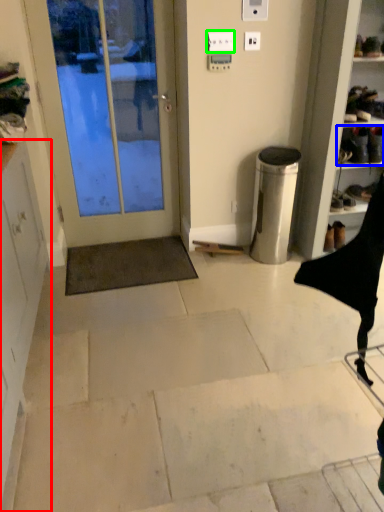
Question: Which is nearer to the cabinetry (highlighted by a red box)? footwear (highlighted by a blue box) or electric outlet (highlighted by a green box).

Choices:
 (A) footwear
 (B) electric outlet

Answer: (B)